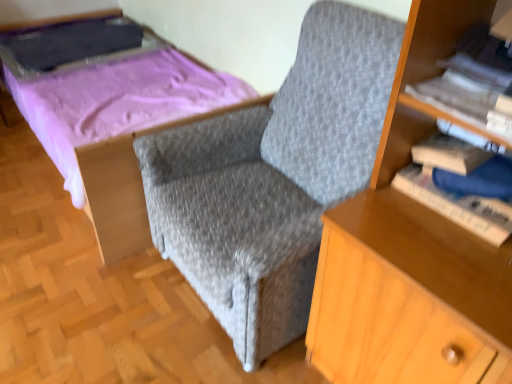
Measure the distance between hardcover book at right, which ranks as the first book in bottom-to-top order, and camera.

A distance of 37.56 inches exists between hardcover book at right, which ranks as the first book in bottom-to-top order, and camera.

Where is `white paper book at upper right, the first book when ordered from top to bottom`? This screenshot has height=384, width=512. white paper book at upper right, the first book when ordered from top to bottom is located at coordinates (463, 89).

From their relative heights in the image, would you say matte purple bed at upper left is taller or shorter than gray fabric armchair at center?

Clearly, matte purple bed at upper left is shorter compared to gray fabric armchair at center.

Considering the points (69, 153) and (242, 253), which point is in front, point (69, 153) or point (242, 253)?

The point (242, 253) is in front.

From the picture: Is matte purple bed at upper left with gray fabric armchair at center?

No.

From a real-world perspective, is matte purple bed at upper left physically located above or below gray fabric armchair at center?

Clearly, from a real-world perspective, matte purple bed at upper left is below gray fabric armchair at center.

You are a GUI agent. You are given a task and a screenshot of the screen. Output one action in this format:
    pyautogui.click(x=<x>, y=<y>)
    Task: Click on the bed located on the left of gray fabric armchair at center
    The height and width of the screenshot is (384, 512).
    Given the screenshot: What is the action you would take?
    pos(115,125)

Which object is closer to the camera, gray fabric armchair at center or matte purple bed at upper left?

gray fabric armchair at center is closer to the camera.

Can you confirm if gray fabric armchair at center is thinner than matte purple bed at upper left?

Yes.

Is hardcover book at right, which ranks as the 2th book in top-to-bottom order, situated inside white paper book at upper right, placed as the 2th book when sorted from bottom to top, or outside?

hardcover book at right, which ranks as the 2th book in top-to-bottom order, is located beyond the bounds of white paper book at upper right, placed as the 2th book when sorted from bottom to top.

From the image's perspective, is hardcover book at right, which ranks as the 2th book in top-to-bottom order, located above or below white paper book at upper right, the first book when ordered from top to bottom?

hardcover book at right, which ranks as the 2th book in top-to-bottom order, is below white paper book at upper right, the first book when ordered from top to bottom.

Where is `book above the hardcover book at right, which ranks as the 2th book in top-to-bottom order (from the image's perspective)`? This screenshot has width=512, height=384. book above the hardcover book at right, which ranks as the 2th book in top-to-bottom order (from the image's perspective) is located at coordinates (463, 89).

Are white paper book at upper right, the first book when ordered from top to bottom, and gray fabric armchair at center located far from each other?

Actually, white paper book at upper right, the first book when ordered from top to bottom, and gray fabric armchair at center are a little close together.

Considering the sizes of objects white paper book at upper right, placed as the 2th book when sorted from bottom to top, and gray fabric armchair at center in the image provided, who is taller, white paper book at upper right, placed as the 2th book when sorted from bottom to top, or gray fabric armchair at center?

gray fabric armchair at center.

Considering the relative sizes of white paper book at upper right, the first book when ordered from top to bottom, and gray fabric armchair at center in the image provided, is white paper book at upper right, the first book when ordered from top to bottom, wider than gray fabric armchair at center?

Incorrect, the width of white paper book at upper right, the first book when ordered from top to bottom, does not surpass that of gray fabric armchair at center.

Who is taller, matte purple bed at upper left or white paper book at upper right, the first book when ordered from top to bottom?

Standing taller between the two is matte purple bed at upper left.

From the picture: Is matte purple bed at upper left further to the viewer compared to white paper book at upper right, placed as the 2th book when sorted from bottom to top?

Yes.

Does matte purple bed at upper left have a smaller size compared to white paper book at upper right, the first book when ordered from top to bottom?

No, matte purple bed at upper left is not smaller than white paper book at upper right, the first book when ordered from top to bottom.

How different are the orientations of matte purple bed at upper left and white paper book at upper right, placed as the 2th book when sorted from bottom to top, in degrees?

There is a 82.9-degree angle between the facing directions of matte purple bed at upper left and white paper book at upper right, placed as the 2th book when sorted from bottom to top.

From a real-world perspective, is hardcover book at right, which ranks as the 2th book in top-to-bottom order, positioned above or below gray fabric armchair at center?

In terms of real-world spatial position, hardcover book at right, which ranks as the 2th book in top-to-bottom order, is above gray fabric armchair at center.

Is hardcover book at right, which ranks as the 2th book in top-to-bottom order, looking in the opposite direction of gray fabric armchair at center?

That's not correct — hardcover book at right, which ranks as the 2th book in top-to-bottom order, is not looking away from gray fabric armchair at center.

Is point (415, 164) farther from camera compared to point (360, 142)?

That is False.

Is hardcover book at right, which ranks as the 2th book in top-to-bottom order, further to camera compared to gray fabric armchair at center?

Yes, it is.

Based on their positions, is hardcover book at right, which ranks as the 2th book in top-to-bottom order, located to the left or right of matte purple bed at upper left?

Based on their positions, hardcover book at right, which ranks as the 2th book in top-to-bottom order, is located to the right of matte purple bed at upper left.

Which book is the 2nd one when counting from the right side of the matte purple bed at upper left? Please provide its 2D coordinates.

[(457, 205)]

Is hardcover book at right, which ranks as the first book in bottom-to-top order, inside the boundaries of matte purple bed at upper left, or outside?

hardcover book at right, which ranks as the first book in bottom-to-top order, exists outside the volume of matte purple bed at upper left.

The height and width of the screenshot is (384, 512). Find the location of `bed behind the gray fabric armchair at center`. bed behind the gray fabric armchair at center is located at coordinates (115, 125).

Where is `chair below the matte purple bed at upper left (from the image's perspective)`? chair below the matte purple bed at upper left (from the image's perspective) is located at coordinates (273, 178).

Based on their spatial positions, is white paper book at upper right, the first book when ordered from top to bottom, or hardcover book at right, which ranks as the first book in bottom-to-top order, closer to gray fabric armchair at center?

Based on the image, hardcover book at right, which ranks as the first book in bottom-to-top order, appears to be nearer to gray fabric armchair at center.

Considering their positions, is hardcover book at right, which ranks as the 2th book in top-to-bottom order, positioned further to white paper book at upper right, the first book when ordered from top to bottom, than matte purple bed at upper left?

matte purple bed at upper left.

Looking at this image, which object lies nearer to the anchor point hardcover book at right, which ranks as the first book in bottom-to-top order, white paper book at upper right, placed as the 2th book when sorted from bottom to top, or gray fabric armchair at center?

white paper book at upper right, placed as the 2th book when sorted from bottom to top, is positioned closer to the anchor hardcover book at right, which ranks as the first book in bottom-to-top order.

Which object lies further to the anchor point gray fabric armchair at center, hardcover book at right, which ranks as the 2th book in top-to-bottom order, or white paper book at upper right, placed as the 2th book when sorted from bottom to top?

white paper book at upper right, placed as the 2th book when sorted from bottom to top, lies further to gray fabric armchair at center than the other object.

From the image, which object appears to be farther from hardcover book at right, which ranks as the 2th book in top-to-bottom order, matte purple bed at upper left or gray fabric armchair at center?

The object further to hardcover book at right, which ranks as the 2th book in top-to-bottom order, is matte purple bed at upper left.

From the image, which object appears to be nearer to gray fabric armchair at center, hardcover book at right, which ranks as the first book in bottom-to-top order, or matte purple bed at upper left?

hardcover book at right, which ranks as the first book in bottom-to-top order, is positioned closer to the anchor gray fabric armchair at center.

Based on their spatial positions, is gray fabric armchair at center or matte purple bed at upper left further from white paper book at upper right, placed as the 2th book when sorted from bottom to top?

Among the two, matte purple bed at upper left is located further to white paper book at upper right, placed as the 2th book when sorted from bottom to top.

From the picture: Which object lies nearer to the anchor point hardcover book at right, which ranks as the first book in bottom-to-top order, gray fabric armchair at center or white paper book at upper right, placed as the 2th book when sorted from bottom to top?

white paper book at upper right, placed as the 2th book when sorted from bottom to top, is positioned closer to the anchor hardcover book at right, which ranks as the first book in bottom-to-top order.

In order to click on chair between matte purple bed at upper left and white paper book at upper right, placed as the 2th book when sorted from bottom to top in this screenshot , I will do `click(273, 178)`.

Identify the location of chair between matte purple bed at upper left and hardcover book at right, which ranks as the first book in bottom-to-top order. coord(273,178).

Where is `book between matte purple bed at upper left and hardcover book at right, which ranks as the 2th book in top-to-bottom order, from left to right`? This screenshot has width=512, height=384. book between matte purple bed at upper left and hardcover book at right, which ranks as the 2th book in top-to-bottom order, from left to right is located at coordinates (463, 89).

In order to click on book located between gray fabric armchair at center and hardcover book at right, which ranks as the 2th book in top-to-bottom order, in the left-right direction in this screenshot , I will do `click(463, 89)`.